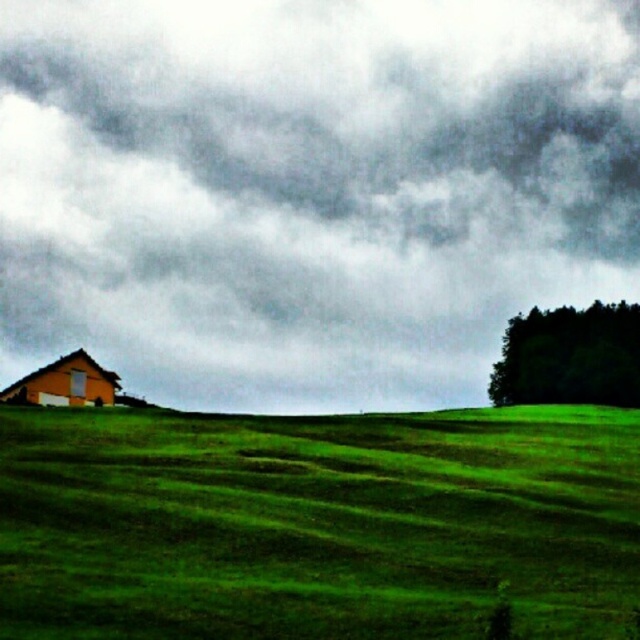
In the scene shown: Does dark gray cloud at upper center appear under green grassy hillside at lower left?

Actually, dark gray cloud at upper center is above green grassy hillside at lower left.

Who is positioned more to the right, dark gray cloud at upper center or green grassy hillside at lower left?

Positioned to the right is green grassy hillside at lower left.

Based on the photo, measure the distance between point (621, 179) and camera.

The distance of point (621, 179) from camera is 339.42 meters.

Locate an element on the screen. The height and width of the screenshot is (640, 640). dark gray cloud at upper center is located at coordinates (308, 189).

Can you confirm if dark gray cloud at upper center is positioned to the right of dark green textured trees at right?

No, dark gray cloud at upper center is not to the right of dark green textured trees at right.

Does dark gray cloud at upper center have a lesser width compared to dark green textured trees at right?

Incorrect, dark gray cloud at upper center's width is not less than dark green textured trees at right's.

Identify the location of dark gray cloud at upper center. The width and height of the screenshot is (640, 640). (308, 189).

Based on the photo, which of these two, dark green textured trees at right or orange matte hut at left, stands shorter?

orange matte hut at left

Can you confirm if dark green textured trees at right is bigger than orange matte hut at left?

Correct, dark green textured trees at right is larger in size than orange matte hut at left.

This screenshot has height=640, width=640. Describe the element at coordinates (570, 356) in the screenshot. I see `dark green textured trees at right` at that location.

Find the location of a particular element. The width and height of the screenshot is (640, 640). dark green textured trees at right is located at coordinates (570, 356).